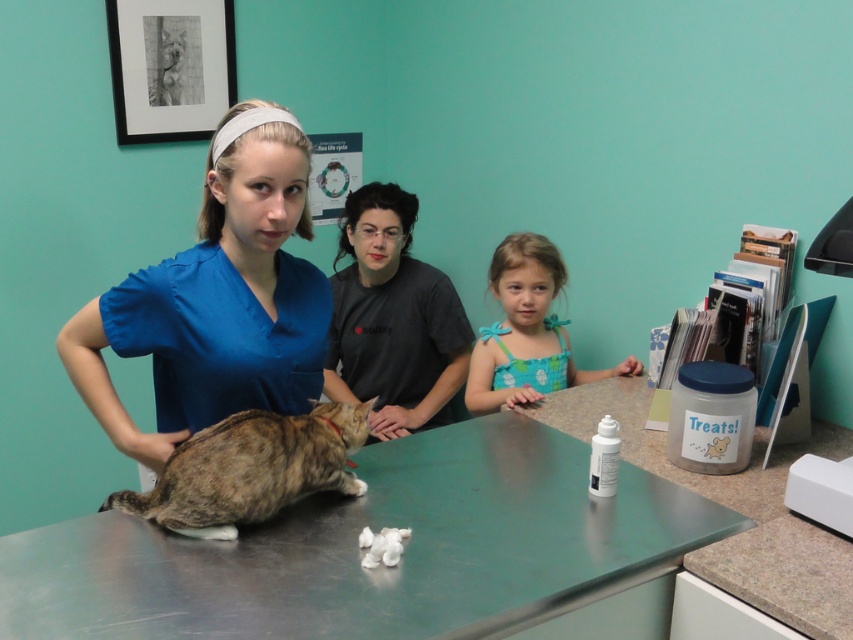
You are a service robot in the veterinary clinic. You need to deliver a medical kit to the blue scrubs at center. Is the distance within your 1.5 meters delivery range?

The distance of blue scrubs at center from viewer is 1.31 meters, which is within the 1.5 meters delivery range. The service robot can deliver the medical kit to the blue scrubs at center.

You are a photographer positioned in front of the veterinary clinic scene. You need to determine which of the two points, point [520,435] or point [769,541], is closer to you. Which one is closer?

Point [520,435] is closer to you because it is further to the viewer than point [769,541].

What are the coordinates of the stainless steel table at center?

The stainless steel table at center is located at point (380, 566).